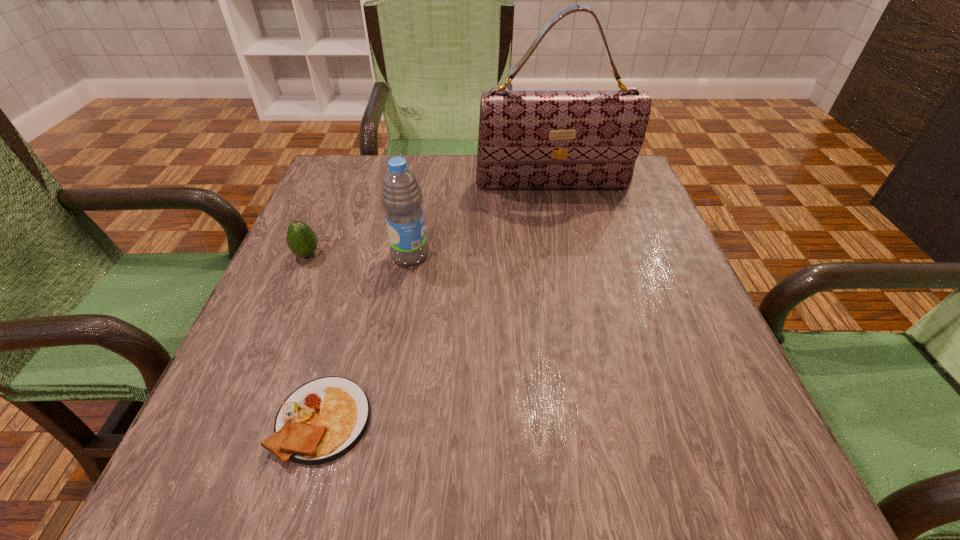
Image resolution: width=960 pixels, height=540 pixels. In order to click on the farthest object in this screenshot , I will do `click(528, 139)`.

What are the coordinates of `the rightmost object` in the screenshot? It's located at (x=528, y=139).

Find the location of `water bottle`. water bottle is located at coordinates (401, 196).

Locate an element on the screen. avocado is located at coordinates (301, 239).

In order to click on the third tallest object in this screenshot , I will do `click(301, 239)`.

Where is `the shortest object`? The image size is (960, 540). the shortest object is located at coordinates (x=322, y=420).

At what (x,y) coordinates should I click in order to perform the action: click on the nearest object. Please return your answer as a coordinate pair (x, y). This screenshot has width=960, height=540. Looking at the image, I should click on (322, 420).

I want to click on free space located 0.240m on the front of the tallest object with the clasp, so click(568, 260).

You are a GUI agent. You are given a task and a screenshot of the screen. Output one action in this format:
    pyautogui.click(x=<x>, y=<y>)
    Task: Click on the vacant region located on the front of the second tallest object
    The width and height of the screenshot is (960, 540).
    Given the screenshot: What is the action you would take?
    pyautogui.click(x=396, y=342)

You are a GUI agent. You are given a task and a screenshot of the screen. Output one action in this format:
    pyautogui.click(x=<x>, y=<y>)
    Task: Click on the vacant space located on the right of the leftmost object
    
    Given the screenshot: What is the action you would take?
    [396, 254]